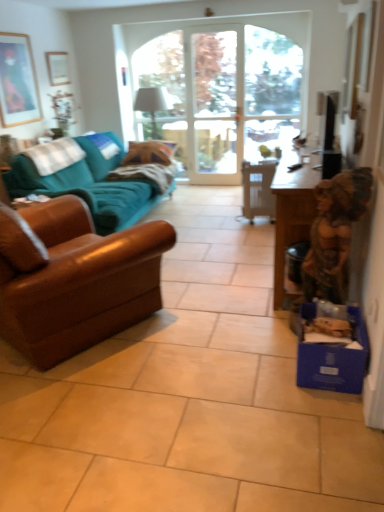
Question: Is white plastic chair at center inside clear glass door at center?

Choices:
 (A) yes
 (B) no

Answer: (B)

Question: Is clear glass door at center not inside white plastic chair at center?

Choices:
 (A) no
 (B) yes

Answer: (B)

Question: Is clear glass door at center bigger than white plastic chair at center?

Choices:
 (A) yes
 (B) no

Answer: (A)

Question: Is clear glass door at center to the left of white plastic chair at center from the viewer's perspective?

Choices:
 (A) no
 (B) yes

Answer: (B)

Question: Is clear glass door at center to the right of white plastic chair at center from the viewer's perspective?

Choices:
 (A) yes
 (B) no

Answer: (B)

Question: Is blue cardboard box at lower right to the left or to the right of white plastic chair at center in the image?

Choices:
 (A) left
 (B) right

Answer: (B)

Question: From the image's perspective, is blue cardboard box at lower right positioned above or below white plastic chair at center?

Choices:
 (A) above
 (B) below

Answer: (B)

Question: In the image, is blue cardboard box at lower right positioned in front of or behind white plastic chair at center?

Choices:
 (A) behind
 (B) front

Answer: (B)

Question: Considering the positions of point (347, 351) and point (274, 202), is point (347, 351) closer or farther from the camera than point (274, 202)?

Choices:
 (A) closer
 (B) farther

Answer: (A)

Question: Visually, is brown leather couch at left, the second studio couch viewed from the back, positioned to the left or to the right of clear glass door at center?

Choices:
 (A) right
 (B) left

Answer: (B)

Question: Considering the positions of brown leather couch at left, the second studio couch viewed from the back, and clear glass door at center in the image, is brown leather couch at left, the second studio couch viewed from the back, wider or thinner than clear glass door at center?

Choices:
 (A) wide
 (B) thin

Answer: (A)

Question: Relative to clear glass door at center, is brown leather couch at left, the second studio couch viewed from the back, in front or behind?

Choices:
 (A) front
 (B) behind

Answer: (A)

Question: From the image's perspective, is brown leather couch at left, the second studio couch viewed from the back, located above or below clear glass door at center?

Choices:
 (A) below
 (B) above

Answer: (A)

Question: Would you say teal fabric couch at left, which ranks as the 2th studio couch in front-to-back order, is inside or outside brown leather couch at left, the second studio couch viewed from the back?

Choices:
 (A) inside
 (B) outside

Answer: (B)

Question: Is point (89, 150) positioned closer to the camera than point (36, 294)?

Choices:
 (A) closer
 (B) farther

Answer: (B)